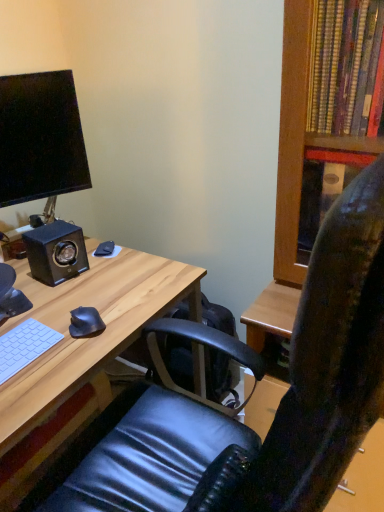
Find the location of a particular element. This screenshot has width=384, height=512. free space between black matte mouse at lower left, marked as the 1th mouse in a front-to-back arrangement, and white matte keyboard at lower left is located at coordinates (51, 357).